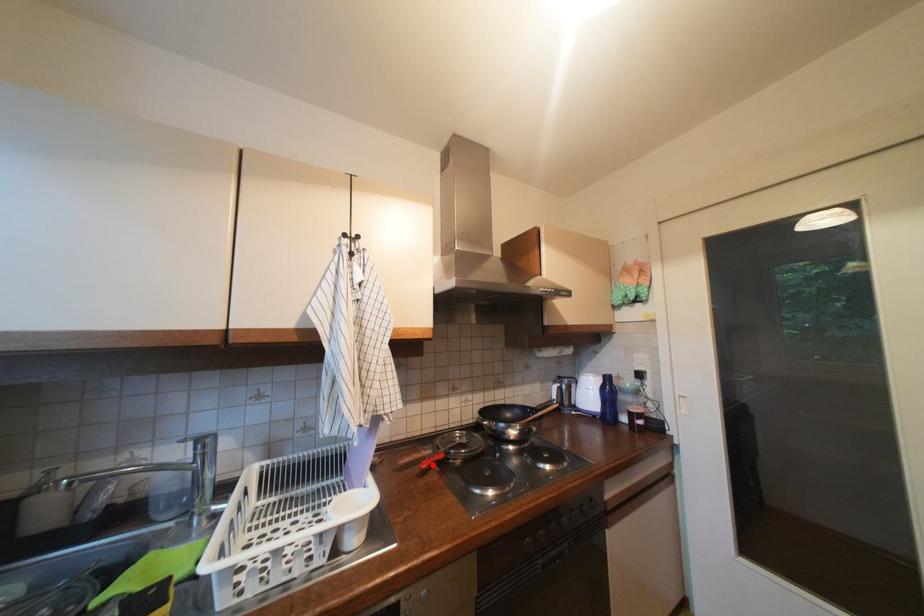
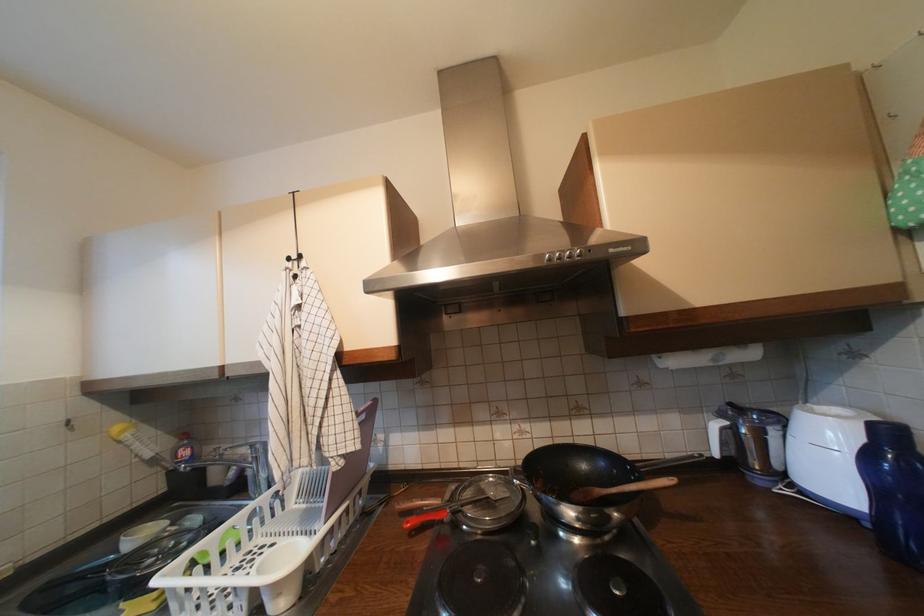
The point at the highlighted location is marked in the first image. Where is the corresponding point in the second image?

(417, 524)